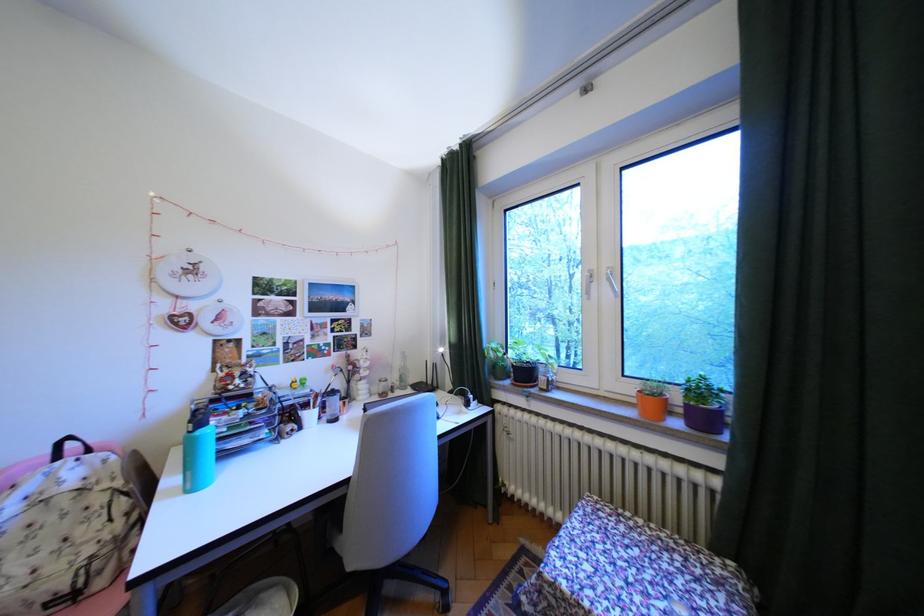
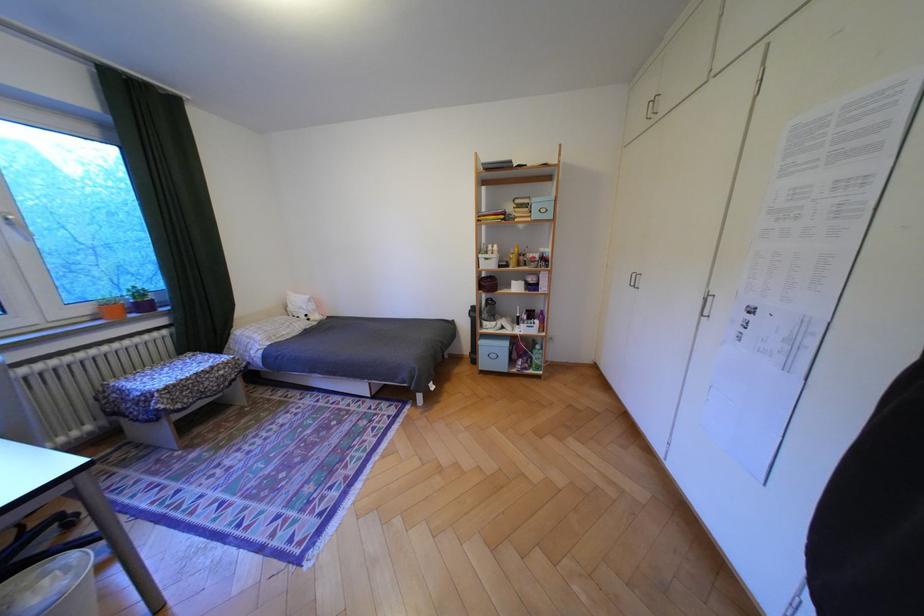
Find the pixel in the second image that matches the point at 641,390 in the first image.

(99, 310)